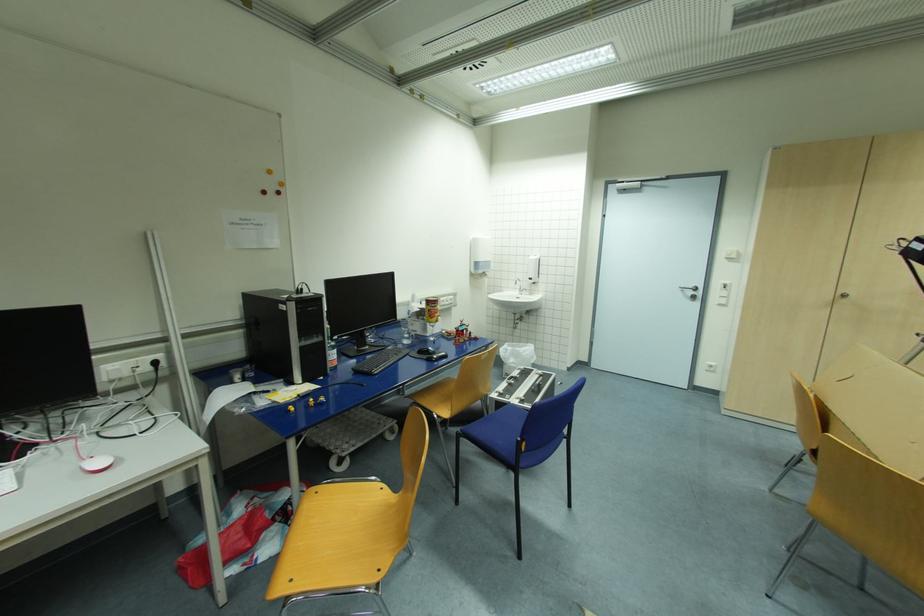
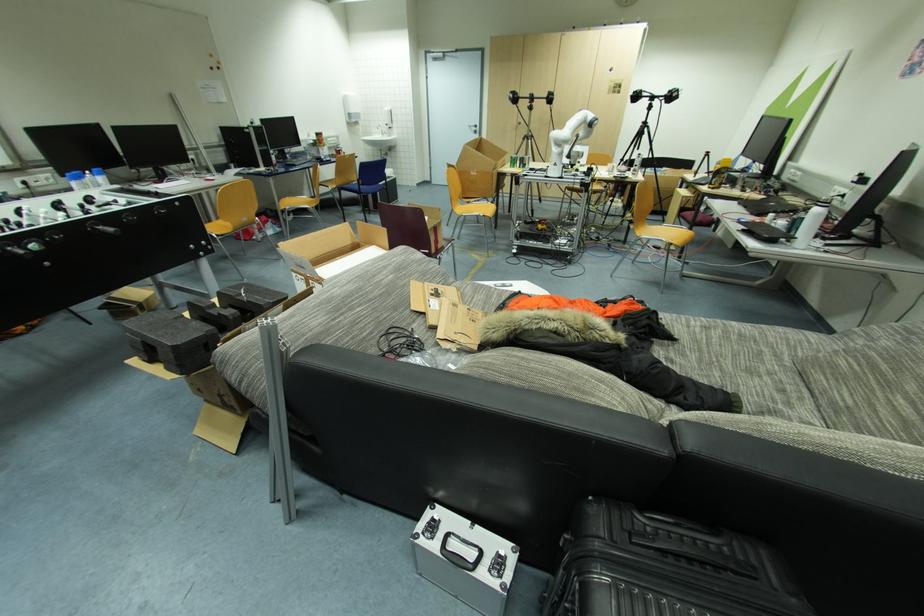
Question: The images are taken continuously from a first-person perspective. In which direction are you moving?

Choices:
 (A) Left
 (B) Right
 (C) Forward
 (D) Backward

Answer: (D)